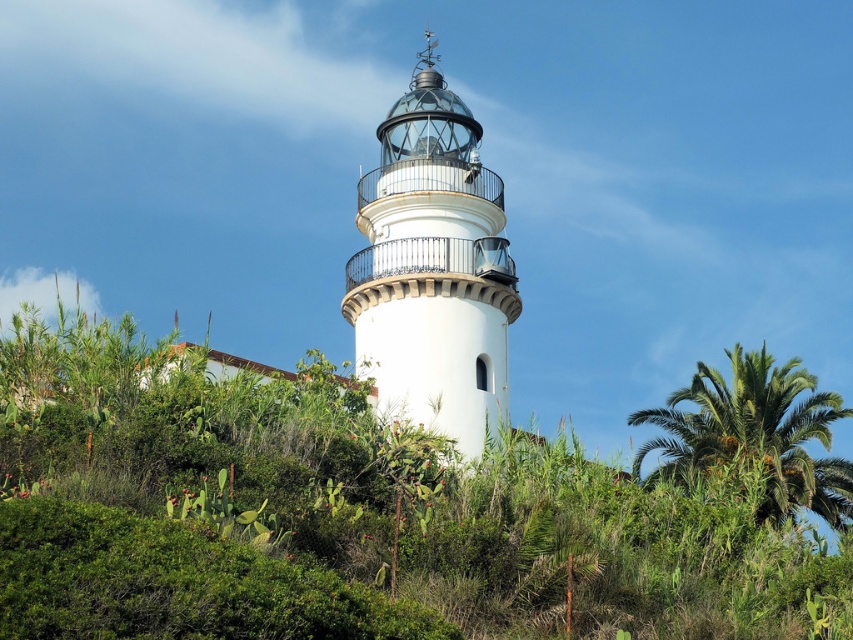
You are standing at the point marked by the coordinates point (x=433, y=268). What object are you directly at?

You are directly at the white matte light tower at center marked by the coordinates point (x=433, y=268).